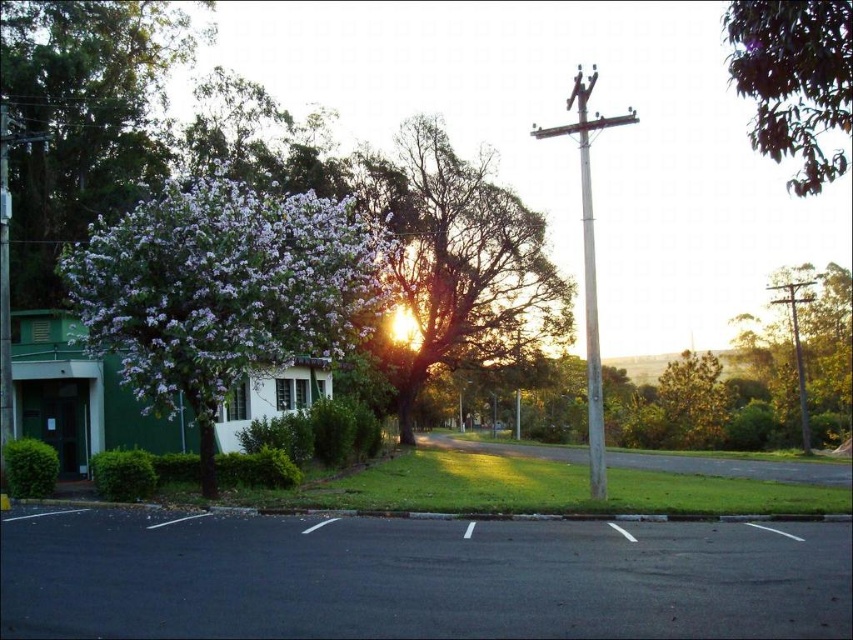
Is purple leafy tree at center closer to camera compared to green leafy tree at upper right?

No, it is not.

Is purple leafy tree at center below green leafy tree at upper right?

Yes.

Which is in front, point (508, 301) or point (834, 52)?

Point (834, 52)

In order to click on purple leafy tree at center in this screenshot , I will do `click(460, 260)`.

Does purple leafy tree at center have a greater width compared to green textured pole at right?

No, purple leafy tree at center is not wider than green textured pole at right.

Between point (509, 317) and point (833, 326), which one is positioned in front?

Point (509, 317)

This screenshot has height=640, width=853. What are the coordinates of `purple leafy tree at center` in the screenshot? It's located at (460, 260).

Does green leafy tree at upper right have a smaller size compared to green textured pole at right?

Incorrect, green leafy tree at upper right is not smaller in size than green textured pole at right.

Based on the photo, measure the distance between green leafy tree at upper right and camera.

green leafy tree at upper right is 22.13 feet away from camera.

The width and height of the screenshot is (853, 640). Describe the element at coordinates (793, 81) in the screenshot. I see `green leafy tree at upper right` at that location.

You are a GUI agent. You are given a task and a screenshot of the screen. Output one action in this format:
    pyautogui.click(x=<x>, y=<y>)
    Task: Click on the green leafy tree at upper right
    
    Given the screenshot: What is the action you would take?
    pyautogui.click(x=793, y=81)